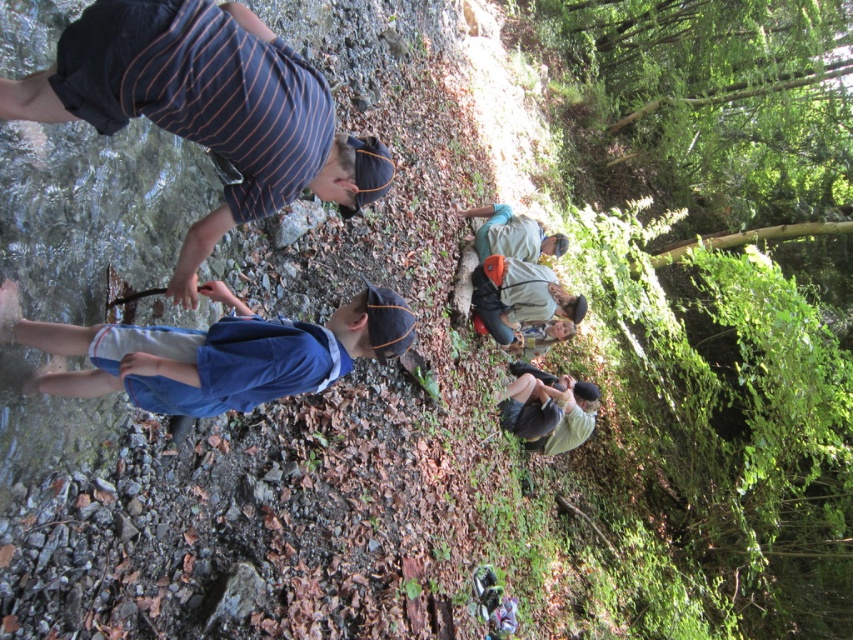
Does striped cotton shirt at upper left come in front of light green fabric at lower right?

Yes, it is in front of light green fabric at lower right.

Is point (77, 84) in front of point (567, 392)?

Yes, it is in front of point (567, 392).

The height and width of the screenshot is (640, 853). Find the location of `striped cotton shirt at upper left`. striped cotton shirt at upper left is located at coordinates (206, 108).